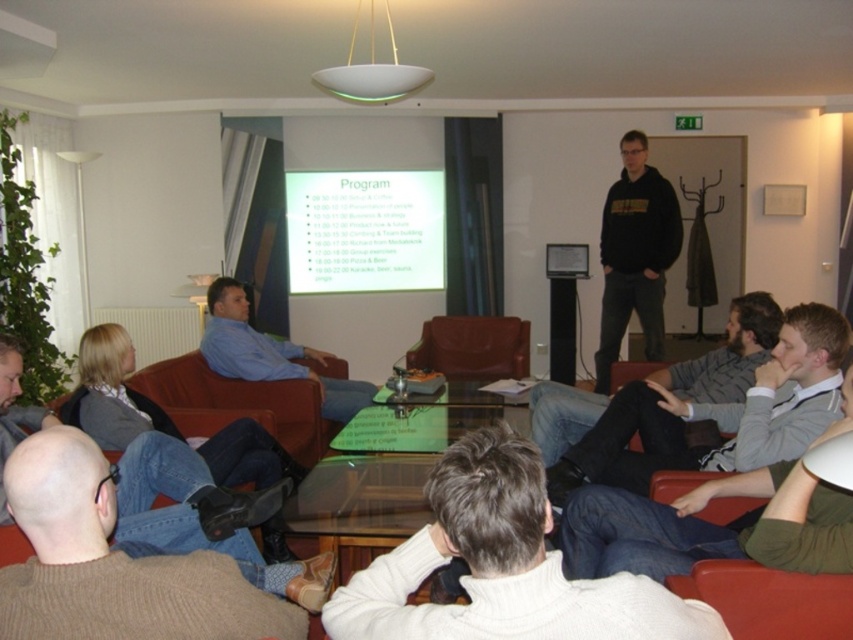
Question: Which object is closer to the camera taking this photo?

Choices:
 (A) white glossy projection screen at upper center
 (B) brown knitted sweater at lower left
 (C) blue denim jeans at lower left
 (D) gray sweater at lower right

Answer: (B)

Question: Is brown knitted sweater at lower left further to camera compared to black hoodie at center?

Choices:
 (A) yes
 (B) no

Answer: (B)

Question: Which object is closer to the camera taking this photo?

Choices:
 (A) blue shirt at center
 (B) white glossy projection screen at upper center
 (C) white sweater at center
 (D) leather at center

Answer: (C)

Question: Is blue denim jeans at lower left bigger than black hoodie at center?

Choices:
 (A) yes
 (B) no

Answer: (B)

Question: Is gray sweater at lower right positioned at the back of black hoodie at center?

Choices:
 (A) no
 (B) yes

Answer: (A)

Question: Which point is farther to the camera?

Choices:
 (A) (463, 352)
 (B) (589, 456)
 (C) (234, 323)
 (D) (538, 550)

Answer: (A)